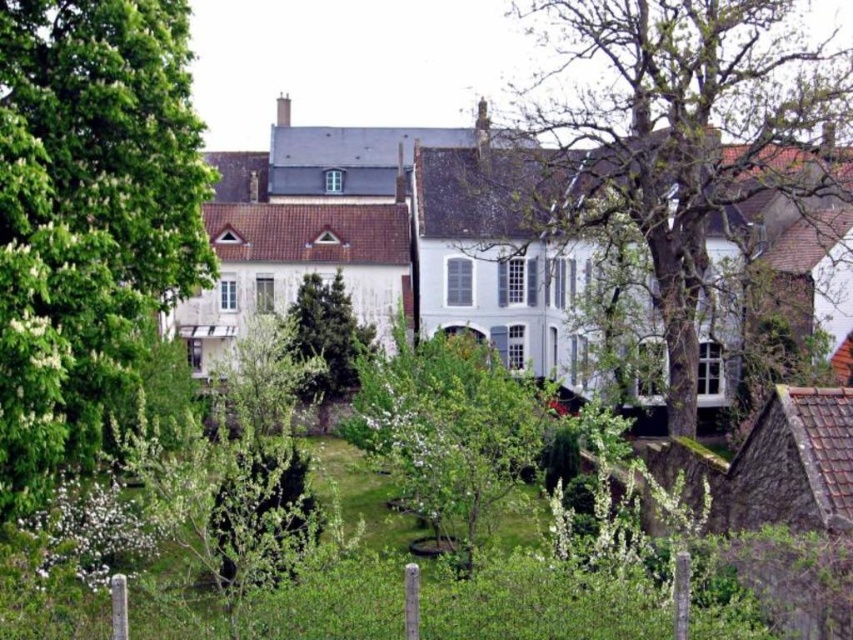
Question: Which point appears farthest from the camera in this image?

Choices:
 (A) pos(621,49)
 (B) pos(387,365)

Answer: (A)

Question: Can you confirm if green leafy tree at left is bigger than green textured tree at center?

Choices:
 (A) no
 (B) yes

Answer: (B)

Question: Is green leafy tree at center above green textured tree at center?

Choices:
 (A) yes
 (B) no

Answer: (A)

Question: Can you confirm if green leafy tree at left is positioned to the left of smooth bark tree at center?

Choices:
 (A) no
 (B) yes

Answer: (B)

Question: Estimate the real-world distances between objects in this image. Which object is farther from the green leafy tree at center?

Choices:
 (A) green leafy tree at left
 (B) smooth bark tree at center
 (C) green textured tree at center

Answer: (C)

Question: Among these objects, which one is farthest from the camera?

Choices:
 (A) green leafy tree at center
 (B) smooth bark tree at center

Answer: (B)